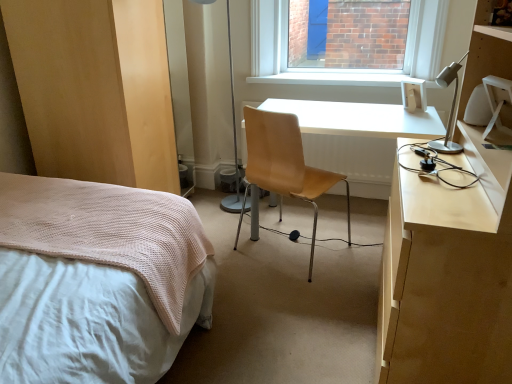
Question: From the image's perspective, relative to white smooth window sill at upper center, is silver metallic desk lamp at upper right above or below?

Choices:
 (A) below
 (B) above

Answer: (A)

Question: Considering the relative positions of silver metallic desk lamp at upper right and white smooth window sill at upper center in the image provided, is silver metallic desk lamp at upper right to the left or to the right of white smooth window sill at upper center?

Choices:
 (A) right
 (B) left

Answer: (A)

Question: Which object is the closest to the silver metallic desk lamp at upper right?

Choices:
 (A) light brown leather chair at center
 (B) white glossy desk at center
 (C) white smooth window sill at upper center
 (D) metallic silver table lamp at center
 (E) white textured bed at left

Answer: (B)

Question: Which of these objects is positioned farthest from the light brown wood dresser at lower left?

Choices:
 (A) white textured bed at left
 (B) white smooth window sill at upper center
 (C) metallic silver table lamp at center
 (D) light brown leather chair at center
 (E) white glossy desk at center

Answer: (B)